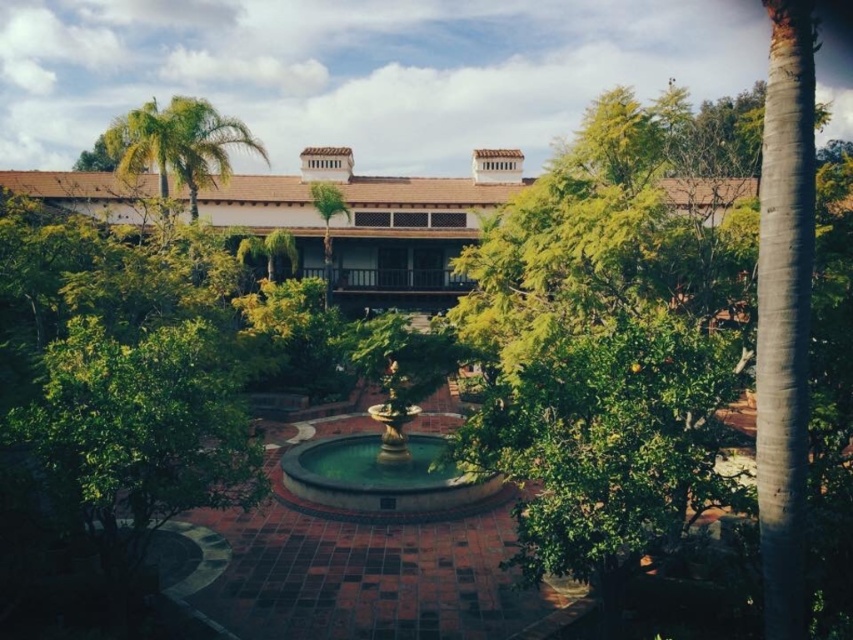
You are standing in the courtyard and want to locate the brown tile roof at upper center. According to the scene description, where should you look?

The brown tile roof at upper center is located at point (373, 221), so you should look towards the upper center area of the scene to find it.

You are standing in the courtyard looking towards the fountain. Which object, the brown tile roof at upper center or the green leafy palm tree at upper left, is taller?

The green leafy palm tree at upper left is taller than the brown tile roof at upper center.

Based on the photo, you are standing in the courtyard and looking up at the roof above. Which object is located at the coordinates point (373, 221)?

The point (373, 221) is on the brown tile roof at upper center.